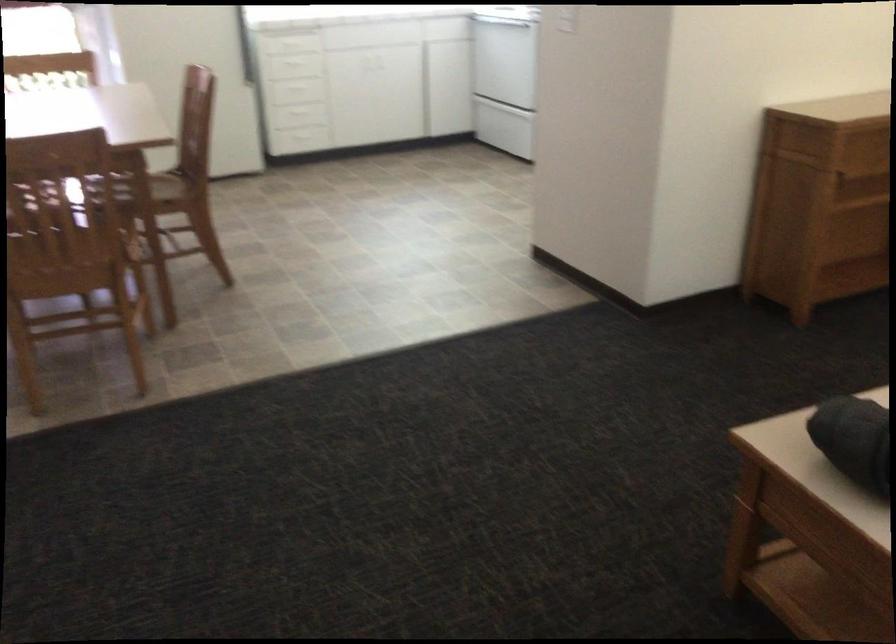
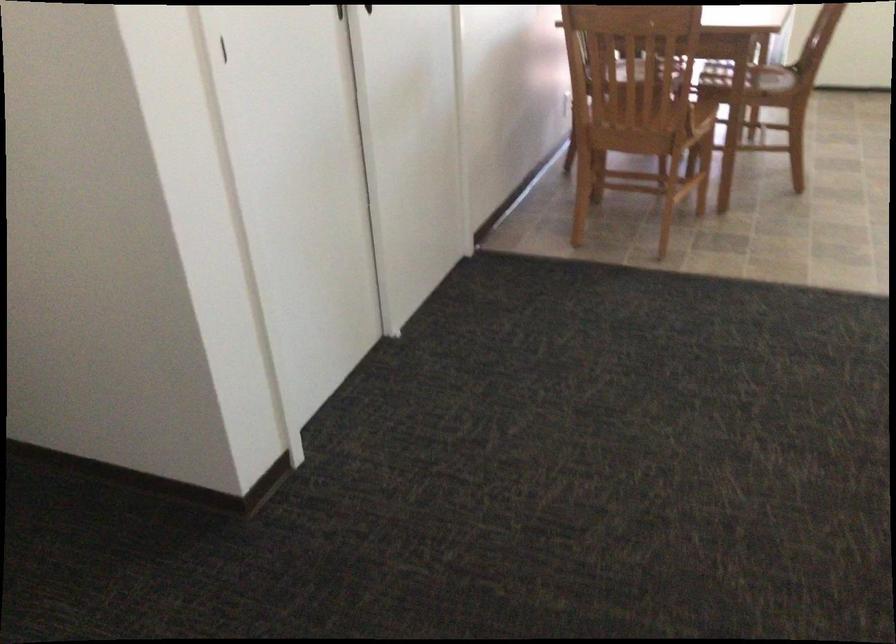
Locate, in the second image, the point that corresponds to (x=136, y=200) in the first image.

(746, 84)